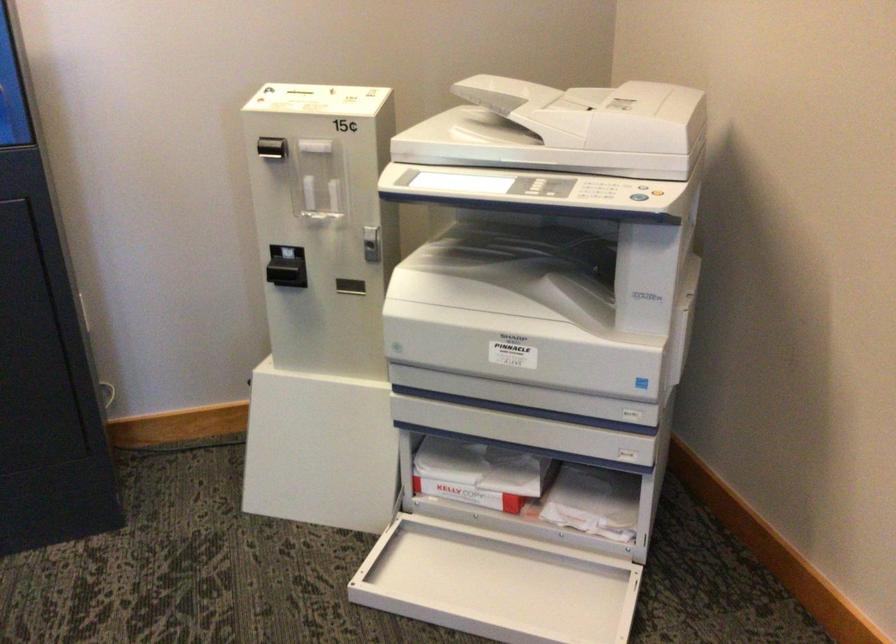
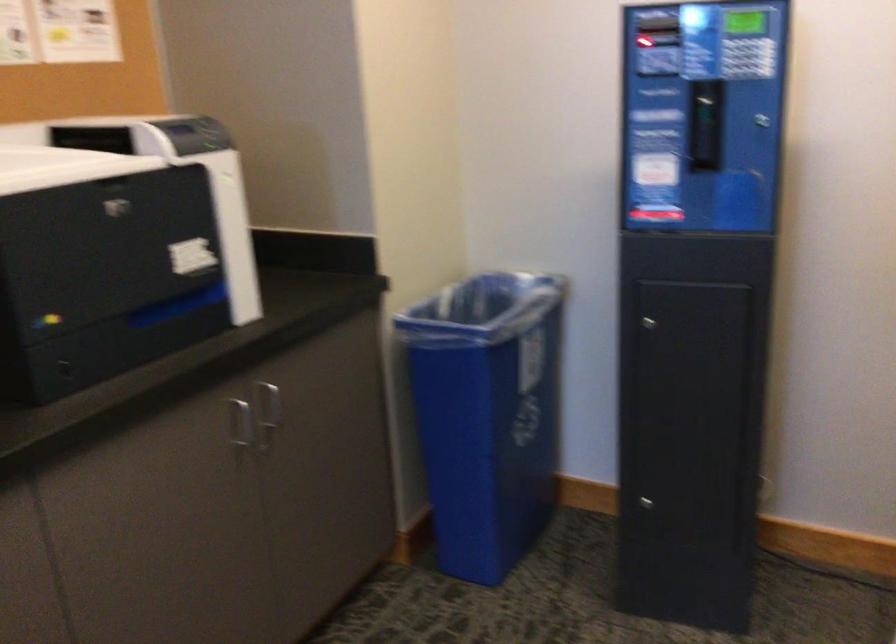
Question: How did the camera likely rotate?

Choices:
 (A) Left
 (B) Right
 (C) Up
 (D) Down

Answer: (A)